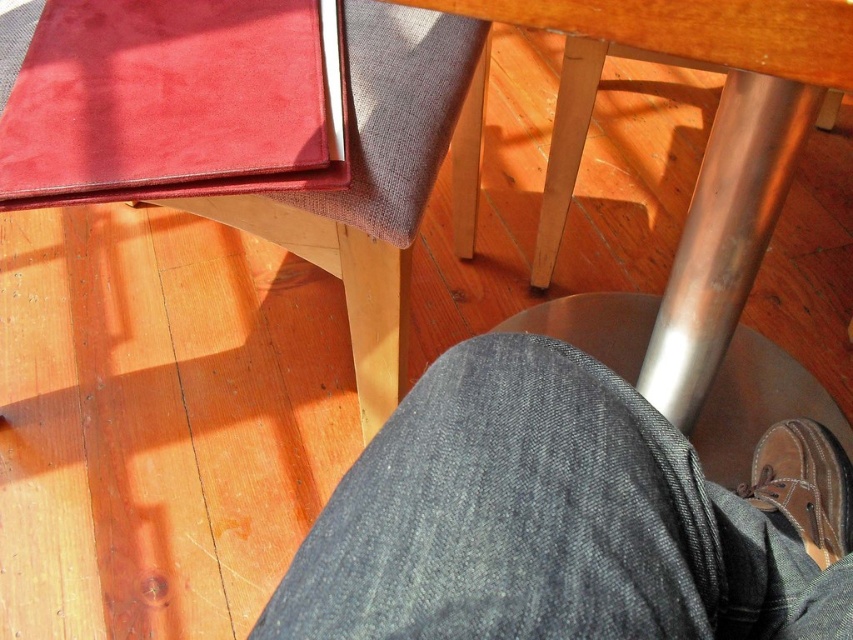
Question: Which of the following is the farthest from the observer?

Choices:
 (A) suede-like red pad at upper left
 (B) dark blue denim jeans at lower center

Answer: (A)

Question: Which point appears closest to the camera in this image?

Choices:
 (A) pos(225,128)
 (B) pos(839,570)

Answer: (B)

Question: Which point is closer to the camera?

Choices:
 (A) (320, 150)
 (B) (849, 541)

Answer: (A)

Question: Considering the relative positions of dark blue denim jeans at lower center and brown leather shoe at lower right in the image provided, where is dark blue denim jeans at lower center located with respect to brown leather shoe at lower right?

Choices:
 (A) left
 (B) right

Answer: (A)

Question: Can you confirm if suede-like red pad at upper left is positioned to the right of brown leather shoe at lower right?

Choices:
 (A) yes
 (B) no

Answer: (B)

Question: Is dark blue denim jeans at lower center behind brown leather shoe at lower right?

Choices:
 (A) yes
 (B) no

Answer: (B)